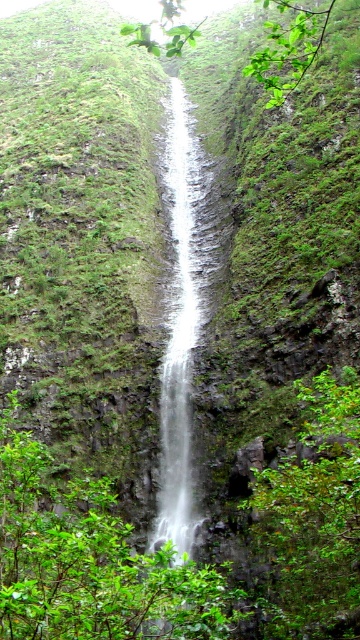
Which is more to the left, green leafy shrubs at center or green leafy bush at lower right?

green leafy shrubs at center

Based on the photo, can you confirm if green leafy shrubs at center is shorter than green leafy bush at lower right?

Yes.

Is point (168, 552) less distant than point (303, 636)?

No, it is not.

Where is `green leafy shrubs at center`? green leafy shrubs at center is located at coordinates (90, 561).

Who is positioned more to the left, green leafy shrubs at center or white smooth waterfall at center?

Positioned to the left is green leafy shrubs at center.

Which is behind, point (5, 609) or point (171, 433)?

Positioned behind is point (171, 433).

What do you see at coordinates (90, 561) in the screenshot? This screenshot has width=360, height=640. I see `green leafy shrubs at center` at bounding box center [90, 561].

This screenshot has height=640, width=360. I want to click on green leafy shrubs at center, so click(x=90, y=561).

Between green leafy bush at lower right and white smooth waterfall at center, which one appears on the left side from the viewer's perspective?

From the viewer's perspective, white smooth waterfall at center appears more on the left side.

Measure the distance from green leafy bush at lower right to white smooth waterfall at center.

The distance of green leafy bush at lower right from white smooth waterfall at center is 14.07 meters.

In order to click on green leafy bush at lower right in this screenshot , I will do `click(313, 516)`.